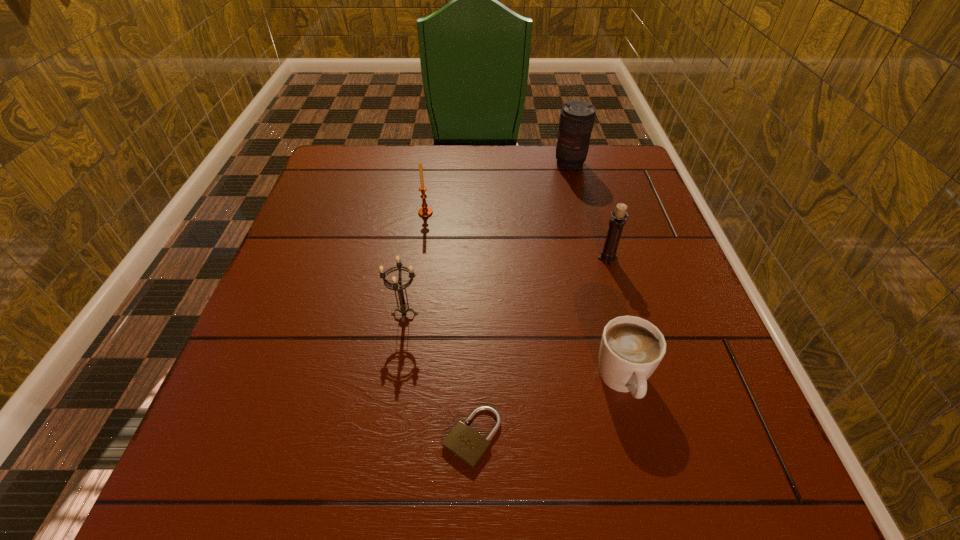
Identify the location of free spot located on the right of the farthest candle holder. The width and height of the screenshot is (960, 540). [x=477, y=213].

You are a GUI agent. You are given a task and a screenshot of the screen. Output one action in this format:
    pyautogui.click(x=<x>, y=<y>)
    Task: Click on the vacant space located on the left of the nearest candle holder
    
    Given the screenshot: What is the action you would take?
    pyautogui.click(x=348, y=314)

This screenshot has width=960, height=540. I want to click on free space located with the handle on the side of the second shortest object, so click(651, 494).

At what (x,y) coordinates should I click in order to perform the action: click on free region located on the right of the third object from left to right. Please return your answer as a coordinate pair (x, y). Looking at the image, I should click on (754, 437).

At what (x,y) coordinates should I click in order to perform the action: click on object present at the far edge. Please return your answer as a coordinate pair (x, y). The width and height of the screenshot is (960, 540). Looking at the image, I should click on (577, 117).

At what (x,y) coordinates should I click in order to perform the action: click on object that is at the near edge. Please return your answer as a coordinate pair (x, y). Looking at the image, I should click on (467, 445).

Locate an element on the screen. This screenshot has width=960, height=540. telephoto lens located in the right edge section of the desktop is located at coordinates (577, 117).

I want to click on candle holder located at the right edge, so click(617, 222).

Identify the location of cappuccino at the right edge. The height and width of the screenshot is (540, 960). (631, 348).

The width and height of the screenshot is (960, 540). What are the coordinates of `object located at the far right corner` in the screenshot? It's located at point(577,117).